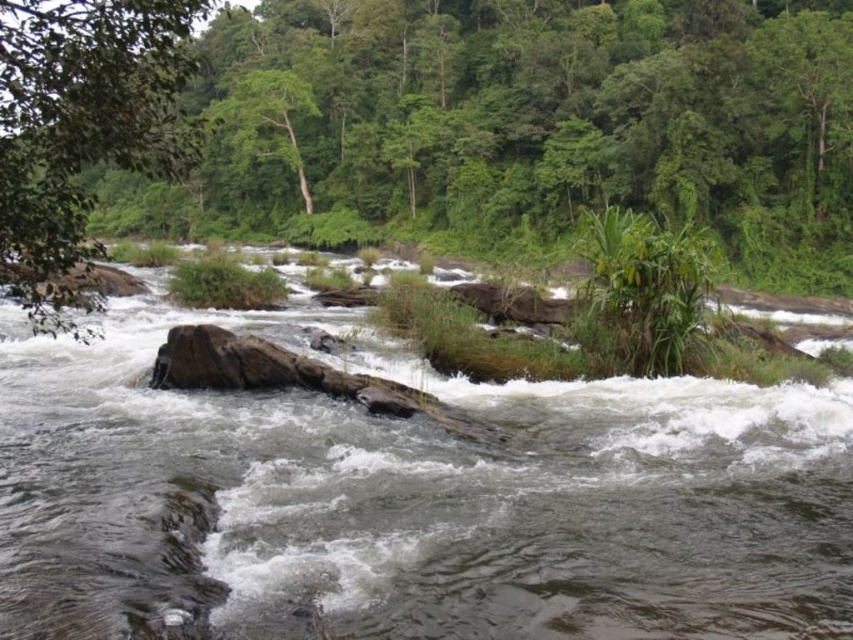
Does brown rock at center have a lesser height compared to green leafy tree at upper center?

Correct, brown rock at center is not as tall as green leafy tree at upper center.

At what (x,y) coordinates should I click in order to perform the action: click on brown rock at center. Please return your answer as a coordinate pair (x, y). Looking at the image, I should click on (409, 500).

At what (x,y) coordinates should I click in order to perform the action: click on brown rock at center. Please return your answer as a coordinate pair (x, y). Image resolution: width=853 pixels, height=640 pixels. Looking at the image, I should click on (409, 500).

Between brown rock at center and green leafy tree at left, which one appears on the right side from the viewer's perspective?

From the viewer's perspective, brown rock at center appears more on the right side.

The height and width of the screenshot is (640, 853). What do you see at coordinates (409, 500) in the screenshot?
I see `brown rock at center` at bounding box center [409, 500].

Does point (633, 520) come closer to viewer compared to point (39, 332)?

Yes, it is.

Where is `brown rock at center`? The image size is (853, 640). brown rock at center is located at coordinates click(409, 500).

Which is in front, point (0, 56) or point (280, 81)?

Point (0, 56) is more forward.

Between green leafy tree at left and green leafy tree at upper center, which one is positioned lower?

green leafy tree at left

Is point (135, 52) positioned after point (254, 92)?

No.

Identify the location of green leafy tree at left. (82, 128).